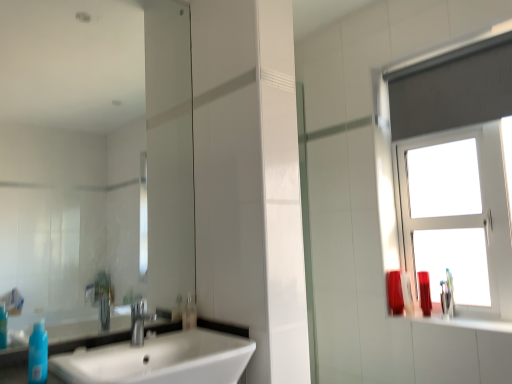
Identify the location of matte plastic container at right, acting as the second toiletry starting from the back. This screenshot has width=512, height=384. (407, 293).

In the scene shown: In order to face clear glass mirror at center, should I rotate leftwards or rightwards?

To face it directly, rotate left by 19.221 degrees.

What do you see at coordinates (100, 178) in the screenshot? The image size is (512, 384). I see `clear glass mirror at center` at bounding box center [100, 178].

Describe the element at coordinates (139, 321) in the screenshot. I see `silver metallic faucet at center` at that location.

Find the location of a particular element. white glass window at upper right is located at coordinates pyautogui.click(x=449, y=175).

Locate an element on the screen. The height and width of the screenshot is (384, 512). blue matte bottle at lower left is located at coordinates (38, 354).

From the image's perspective, is white glass window at upper right above or below blue matte bottle at lower left?

From the image's perspective, white glass window at upper right appears above blue matte bottle at lower left.

Can you confirm if white glass window at upper right is bigger than blue matte bottle at lower left?

Yes, white glass window at upper right is bigger than blue matte bottle at lower left.

Can you tell me how much white glass window at upper right and blue matte bottle at lower left differ in facing direction?

92.8 degrees.

Does white glass window at upper right have a greater width compared to blue matte bottle at lower left?

Indeed, white glass window at upper right has a greater width compared to blue matte bottle at lower left.

From the picture: Would you say white glass window at upper right is outside shiny plastic bottle at right, which is the 4th toiletry in left-to-right order?

Yes.

How many degrees apart are the facing directions of white glass window at upper right and shiny plastic bottle at right, the second toiletry in the front-to-back sequence?

The angular difference between white glass window at upper right and shiny plastic bottle at right, the second toiletry in the front-to-back sequence, is 90.1 degrees.

Could you measure the distance between white glass window at upper right and shiny plastic bottle at right, the second toiletry in the front-to-back sequence?

The distance of white glass window at upper right from shiny plastic bottle at right, the second toiletry in the front-to-back sequence, is 51.18 centimeters.

Is point (389, 162) behind point (422, 297)?

Yes, point (389, 162) is behind point (422, 297).

From a real-world perspective, is white glass window at upper right below matte plastic container at right, which is counted as the third toiletry, starting from the left?

No, from a real-world perspective, white glass window at upper right is not beneath matte plastic container at right, which is counted as the third toiletry, starting from the left.

Does white glass window at upper right touch matte plastic container at right, which is the third toiletry in front-to-back order?

There is a gap between white glass window at upper right and matte plastic container at right, which is the third toiletry in front-to-back order.

Considering the relative sizes of white glass window at upper right and matte plastic container at right, which is counted as the third toiletry, starting from the left, in the image provided, is white glass window at upper right wider than matte plastic container at right, which is counted as the third toiletry, starting from the left,?

Yes, white glass window at upper right is wider than matte plastic container at right, which is counted as the third toiletry, starting from the left.

Considering the positions of objects white glass window at upper right and matte plastic container at right, which is the third toiletry in front-to-back order, in the image provided, who is more to the right, white glass window at upper right or matte plastic container at right, which is the third toiletry in front-to-back order,?

Positioned to the right is white glass window at upper right.

The image size is (512, 384). Find the location of `tap above the clear plastic bottle at center, which is the first toiletry from left to right (from the image's perspective)`. tap above the clear plastic bottle at center, which is the first toiletry from left to right (from the image's perspective) is located at coordinates (139, 321).

Is silver metallic faucet at center positioned beyond the bounds of clear plastic bottle at center, placed as the fourth toiletry when sorted from right to left?

silver metallic faucet at center is positioned outside clear plastic bottle at center, placed as the fourth toiletry when sorted from right to left.

Does silver metallic faucet at center appear on the left side of clear plastic bottle at center, which is counted as the 1th toiletry, starting from the front?

Indeed, silver metallic faucet at center is positioned on the left side of clear plastic bottle at center, which is counted as the 1th toiletry, starting from the front.

Consider the image. What's the angular difference between silver metallic faucet at center and clear plastic bottle at center, placed as the fourth toiletry when sorted from right to left,'s facing directions?

0.00227 degrees.

Which of these two, shiny plastic bottle at right, which is the 4th toiletry in left-to-right order, or white glass window at upper right, stands shorter?

shiny plastic bottle at right, which is the 4th toiletry in left-to-right order.

Which of these two, shiny plastic bottle at right, which is the 4th toiletry in left-to-right order, or white glass window at upper right, is bigger?

white glass window at upper right is bigger.

Based on the photo, is shiny plastic bottle at right, the 1th toiletry in the right-to-left sequence, completely or partially outside of white glass window at upper right?

No, shiny plastic bottle at right, the 1th toiletry in the right-to-left sequence, is not outside of white glass window at upper right.

How distant is shiny plastic bottle at right, placed as the 3th toiletry when sorted from back to front, from white glass window at upper right?

A distance of 20.15 inches exists between shiny plastic bottle at right, placed as the 3th toiletry when sorted from back to front, and white glass window at upper right.

Can you confirm if clear glass mirror at center is taller than blue matte bottle at lower left?

Correct, clear glass mirror at center is much taller as blue matte bottle at lower left.

Does clear glass mirror at center turn towards blue matte bottle at lower left?

Yes, clear glass mirror at center is oriented towards blue matte bottle at lower left.

Is clear glass mirror at center in contact with blue matte bottle at lower left?

No.

Does point (138, 45) appear closer or farther from the camera than point (37, 361)?

Point (138, 45) is farther from the camera than point (37, 361).

Consider the image. Which of these two, matte plastic container at right, placed as the 2th toiletry when sorted from right to left, or clear glass mirror at center, stands shorter?

Standing shorter between the two is matte plastic container at right, placed as the 2th toiletry when sorted from right to left.

From the image's perspective, is matte plastic container at right, which is the third toiletry in front-to-back order, located above or below clear glass mirror at center?

Based on their image positions, matte plastic container at right, which is the third toiletry in front-to-back order, is located beneath clear glass mirror at center.

Is matte plastic container at right, acting as the second toiletry starting from the back, located outside clear glass mirror at center?

matte plastic container at right, acting as the second toiletry starting from the back, is positioned outside clear glass mirror at center.

Image resolution: width=512 pixels, height=384 pixels. What are the coordinates of `bottle located underneath the white glass window at upper right (from a real-world perspective)` in the screenshot? It's located at (38, 354).

Identify the location of window above the shiny plastic bottle at right, which is the 4th toiletry in left-to-right order (from the image's perspective). Image resolution: width=512 pixels, height=384 pixels. (449, 175).

Looking at the image, which one is located closer to shiny plastic bottle at right, the second toiletry in the front-to-back sequence, clear glass mirror at center or clear plastic bottle at center, which is the first toiletry from left to right?

Among the two, clear plastic bottle at center, which is the first toiletry from left to right, is located nearer to shiny plastic bottle at right, the second toiletry in the front-to-back sequence.

Based on their spatial positions, is white glass window at upper right or silver metallic faucet at center closer to white glossy sink at lower left?

silver metallic faucet at center is positioned closer to the anchor white glossy sink at lower left.

Based on their spatial positions, is white glossy sink at lower left or clear glass mirror at center further from matte plastic container at right, placed as the 2th toiletry when sorted from right to left?

clear glass mirror at center is further to matte plastic container at right, placed as the 2th toiletry when sorted from right to left.

When comparing their distances from clear plastic bottle at center, which is counted as the 4th toiletry, starting from the back, does shiny plastic bottle at right, which is the 4th toiletry in left-to-right order, or silver metallic faucet at center seem further?

Among the two, shiny plastic bottle at right, which is the 4th toiletry in left-to-right order, is located further to clear plastic bottle at center, which is counted as the 4th toiletry, starting from the back.

Estimate the real-world distances between objects in this image. Which object is further from matte red vase at right, the second toiletry when ordered from left to right, matte plastic container at right, which is the third toiletry in front-to-back order, or white glossy sink at lower left?

white glossy sink at lower left is positioned further to the anchor matte red vase at right, the second toiletry when ordered from left to right.

Which object lies nearer to the anchor point white glossy sink at lower left, silver metallic faucet at center or white glass window at upper right?

The object closer to white glossy sink at lower left is silver metallic faucet at center.

When comparing their distances from blue matte bottle at lower left, does shiny plastic bottle at right, the second toiletry in the front-to-back sequence, or matte plastic container at right, placed as the 2th toiletry when sorted from right to left, seem closer?

matte plastic container at right, placed as the 2th toiletry when sorted from right to left, is positioned closer to the anchor blue matte bottle at lower left.

Looking at this image, considering their positions, is blue matte bottle at lower left positioned closer to silver metallic faucet at center than clear plastic bottle at center, placed as the fourth toiletry when sorted from right to left?

Among the two, clear plastic bottle at center, placed as the fourth toiletry when sorted from right to left, is located nearer to silver metallic faucet at center.

Locate an element on the screen. toiletry located between clear plastic bottle at center, which is counted as the 1th toiletry, starting from the front, and matte plastic container at right, acting as the second toiletry starting from the back, in the left-right direction is located at coordinates (395, 292).

This screenshot has height=384, width=512. I want to click on sink between clear glass mirror at center and matte plastic container at right, which is counted as the third toiletry, starting from the left, so click(x=163, y=357).

Find the location of `sink situated between clear glass mirror at center and shiny plastic bottle at right, the 1th toiletry in the right-to-left sequence, from left to right`. sink situated between clear glass mirror at center and shiny plastic bottle at right, the 1th toiletry in the right-to-left sequence, from left to right is located at coordinates (163, 357).

The height and width of the screenshot is (384, 512). Identify the location of sink between blue matte bottle at lower left and matte red vase at right, the second toiletry when ordered from left to right, in the horizontal direction. (163, 357).